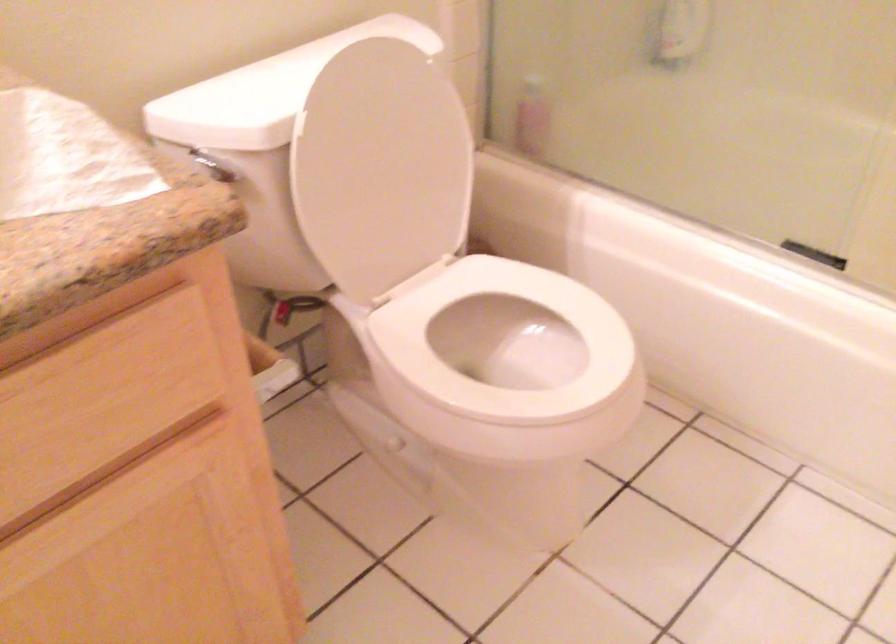
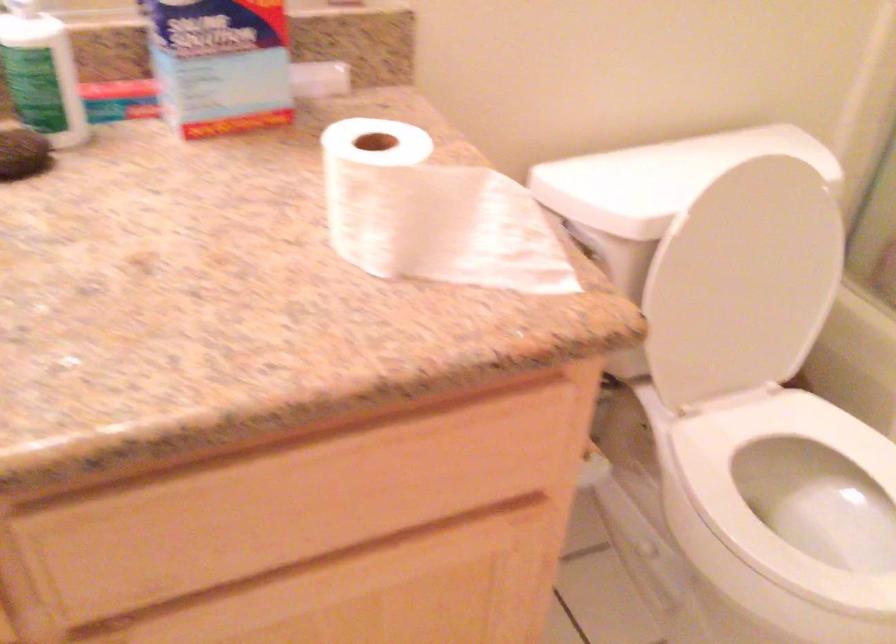
Question: Based on the continuous images, in which direction is the camera rotating? Reply with the corresponding letter.

Choices:
 (A) Left
 (B) Right
 (C) Up
 (D) Down

Answer: (A)